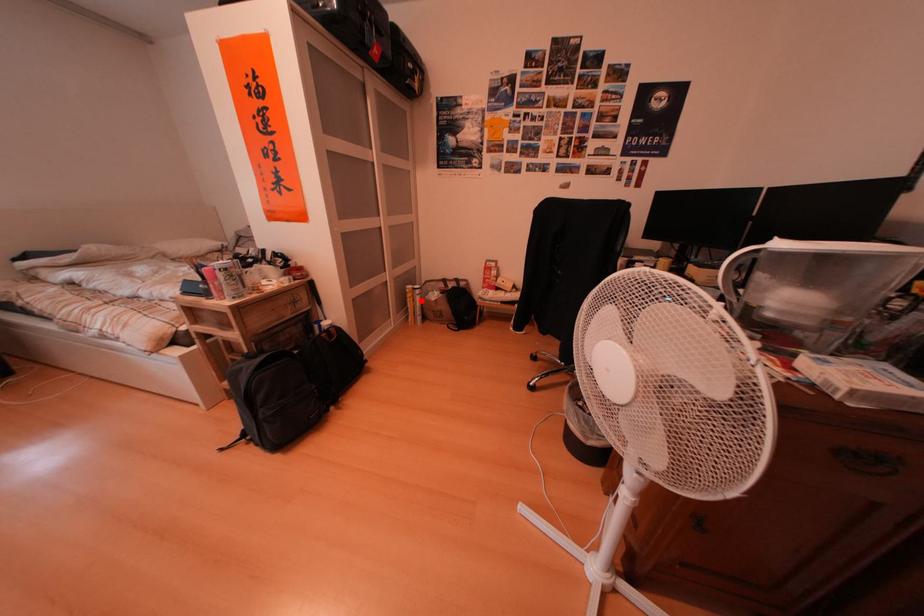
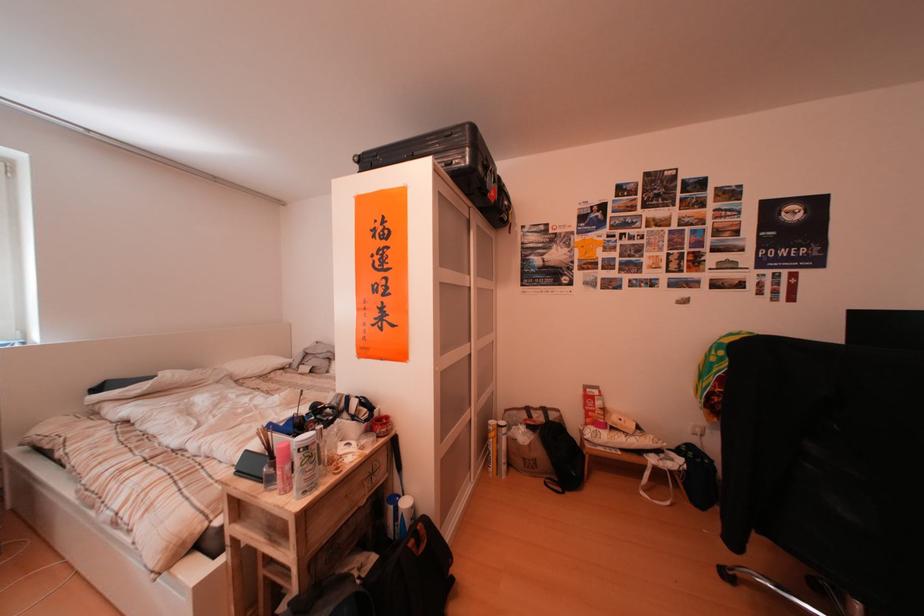
Locate, in the second image, the point that corresponds to the highlighted location in the first image.

(505, 440)